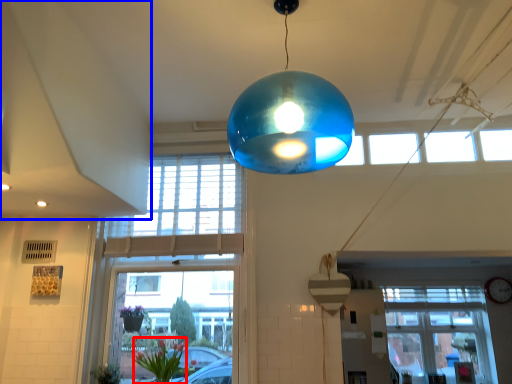
Question: Which point is further to the camera, floral arrangement (highlighted by a red box) or exhaust hood (highlighted by a blue box)?

Choices:
 (A) floral arrangement
 (B) exhaust hood

Answer: (A)